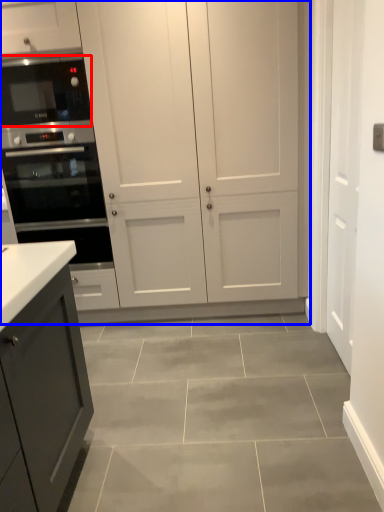
Question: Among these objects, which one is nearest to the camera, microwave oven (highlighted by a red box) or cupboard (highlighted by a blue box)?

Choices:
 (A) microwave oven
 (B) cupboard

Answer: (B)